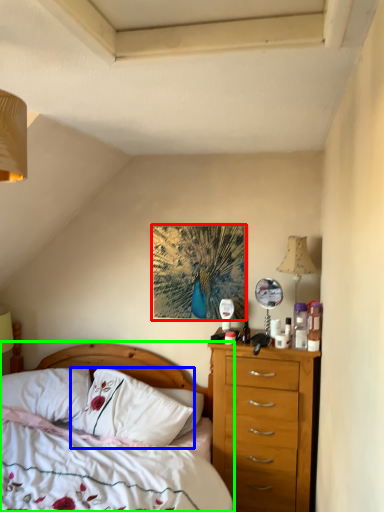
Question: Which object is positioned farthest from picture frame (highlighted by a red box)? Select from pillow (highlighted by a blue box) and bed (highlighted by a green box).

Choices:
 (A) pillow
 (B) bed

Answer: (B)